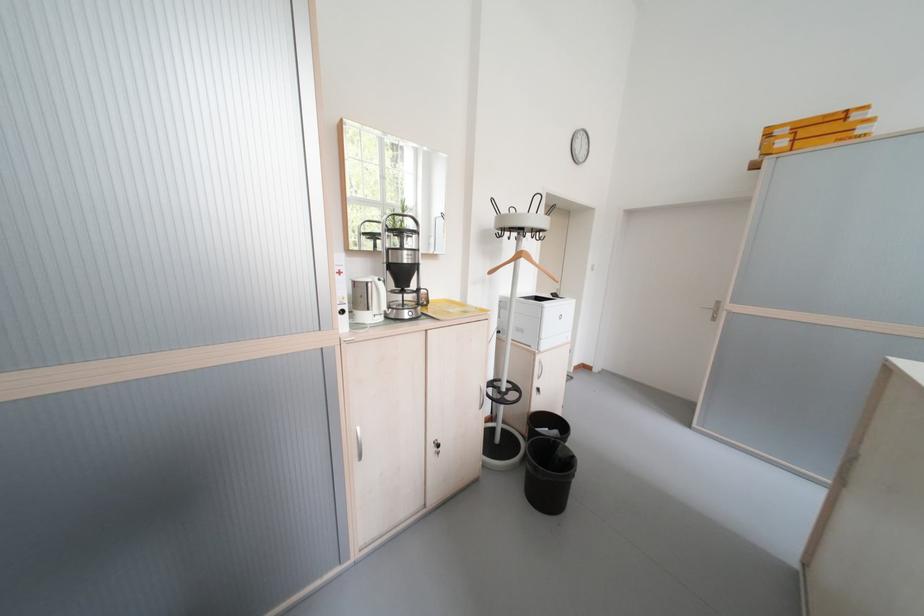
Where would you hang the wooden clothes hanger? Please return your answer as a coordinate pair (x, y).

(524, 264)